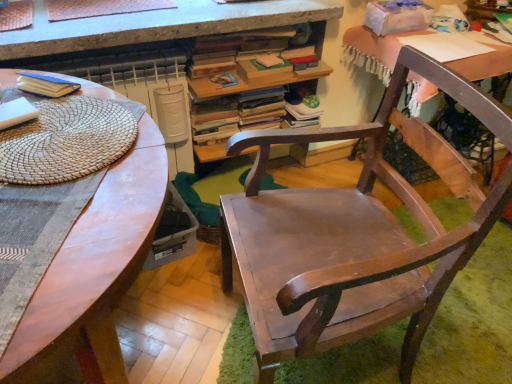
Question: Should I look upward or downward to see wooden chair at center?

Choices:
 (A) down
 (B) up

Answer: (A)

Question: Is matte blue paperback book at upper left bigger than wooden desk at upper right, which appears as the second desk when viewed from the left?

Choices:
 (A) yes
 (B) no

Answer: (B)

Question: Is matte blue paperback book at upper left outside of wooden desk at upper right, the 1th desk in the right-to-left sequence?

Choices:
 (A) no
 (B) yes

Answer: (B)

Question: Does matte blue paperback book at upper left appear on the right side of wooden desk at upper right, the 1th desk in the right-to-left sequence?

Choices:
 (A) yes
 (B) no

Answer: (B)

Question: Considering the relative sizes of matte blue paperback book at upper left and wooden desk at upper right, the 1th desk in the right-to-left sequence, in the image provided, is matte blue paperback book at upper left thinner than wooden desk at upper right, the 1th desk in the right-to-left sequence,?

Choices:
 (A) yes
 (B) no

Answer: (A)

Question: Is wooden desk at upper right, which appears as the second desk when viewed from the left, completely or partially inside matte blue paperback book at upper left?

Choices:
 (A) yes
 (B) no

Answer: (B)

Question: Is matte blue paperback book at upper left positioned in front of wooden desk at upper right, which appears as the second desk when viewed from the left?

Choices:
 (A) yes
 (B) no

Answer: (A)

Question: From the image's perspective, would you say white paper at upper right is shown under matte wooden desk at center, which is the 2th desk in right-to-left order?

Choices:
 (A) no
 (B) yes

Answer: (A)

Question: Is white paper at upper right wider than matte wooden desk at center, which is the 2th desk in right-to-left order?

Choices:
 (A) yes
 (B) no

Answer: (B)

Question: From the image's perspective, is white paper at upper right above matte wooden desk at center, which is the 2th desk in right-to-left order?

Choices:
 (A) yes
 (B) no

Answer: (A)

Question: Can you confirm if white paper at upper right is positioned to the right of matte wooden desk at center, which is the 2th desk in right-to-left order?

Choices:
 (A) yes
 (B) no

Answer: (A)

Question: Considering the relative positions of white paper at upper right and matte wooden desk at center, which is the 2th desk in right-to-left order, in the image provided, is white paper at upper right to the left of matte wooden desk at center, which is the 2th desk in right-to-left order, from the viewer's perspective?

Choices:
 (A) yes
 (B) no

Answer: (B)

Question: Is white paper at upper right placed right next to matte wooden desk at center, which is the 1th desk from left to right?

Choices:
 (A) no
 (B) yes

Answer: (A)

Question: Does wooden chair at center have a smaller size compared to matte blue paperback book at upper left?

Choices:
 (A) yes
 (B) no

Answer: (B)